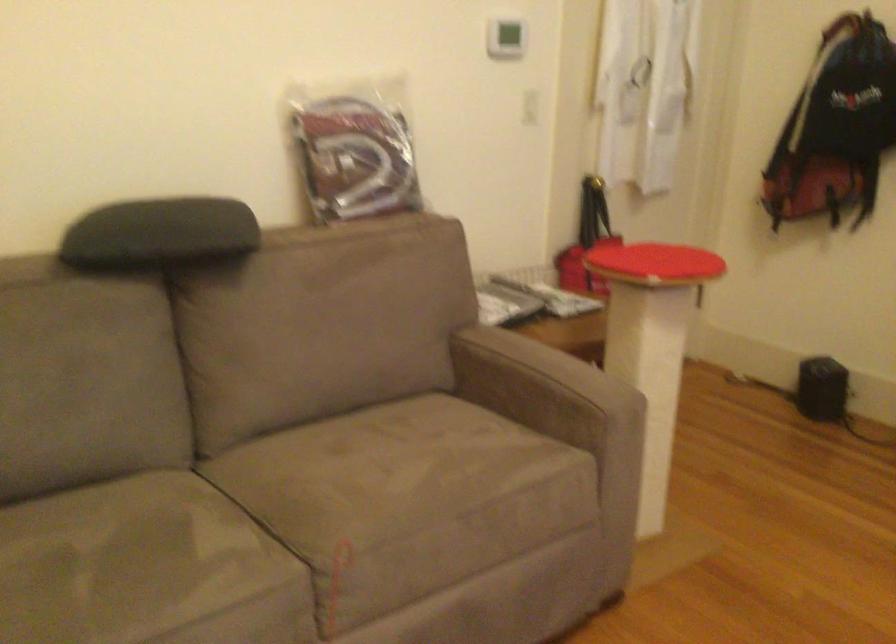
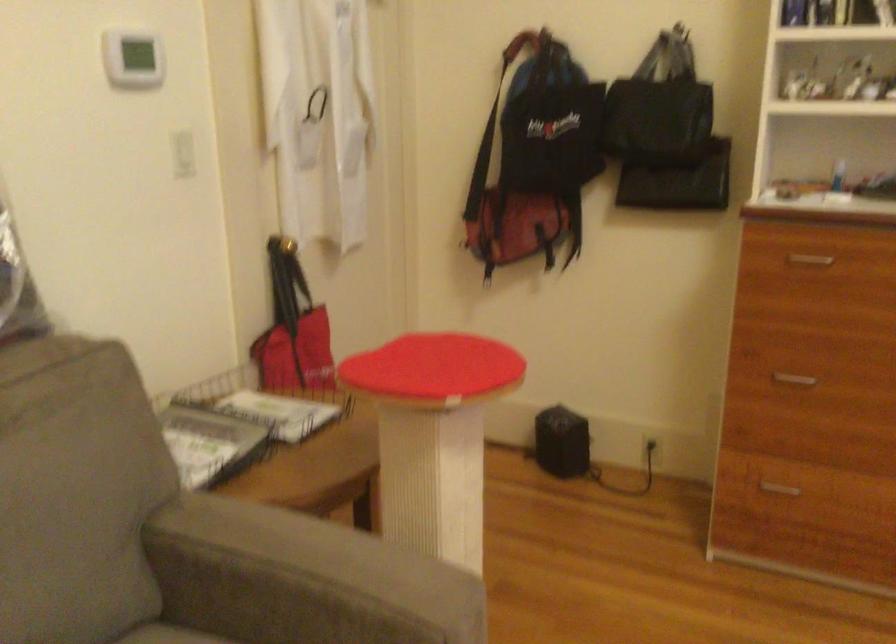
Question: The camera is either moving clockwise (left) or counter-clockwise (right) around the object. The first image is from the beginning of the video and the second image is from the end. Is the camera moving left or right when shooting the video?

Choices:
 (A) Left
 (B) Right

Answer: (A)